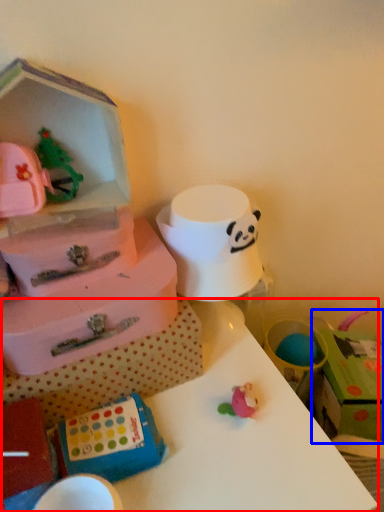
Question: Which object appears closest to the camera in this image, table (highlighted by a red box) or storage box (highlighted by a blue box)?

Choices:
 (A) table
 (B) storage box

Answer: (A)